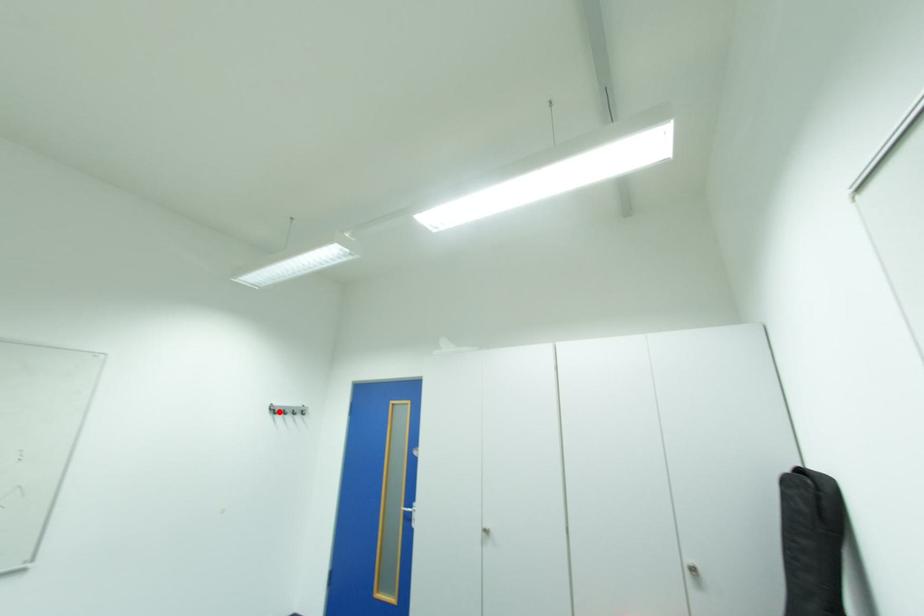
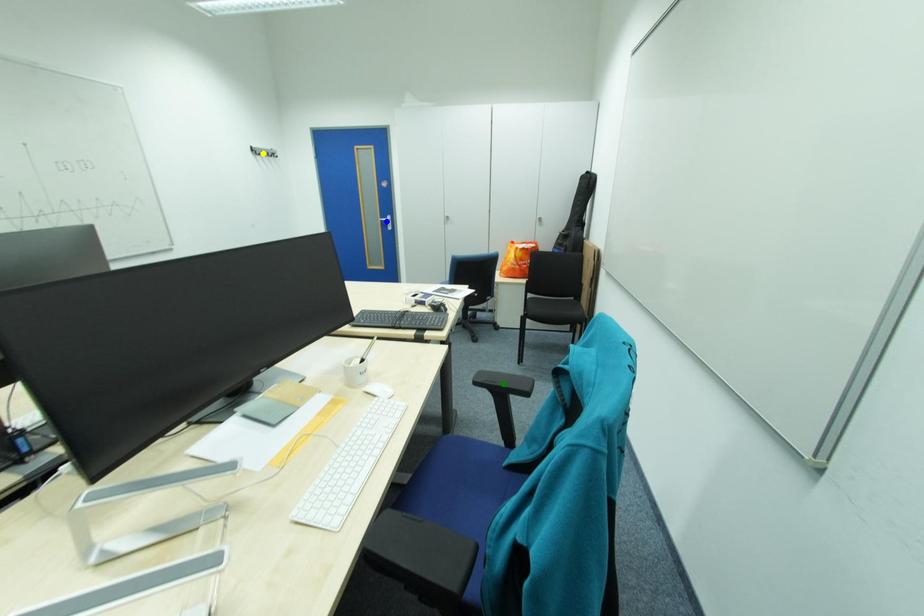
Question: I am providing you with two images of the same scene from different viewpoints. A red point is marked on the first image. You are given multiple points on the second image. Which point in image 2 is actually the same real-world point as the red point in image 1?

Choices:
 (A) yellow point
 (B) green point
 (C) blue point

Answer: (A)